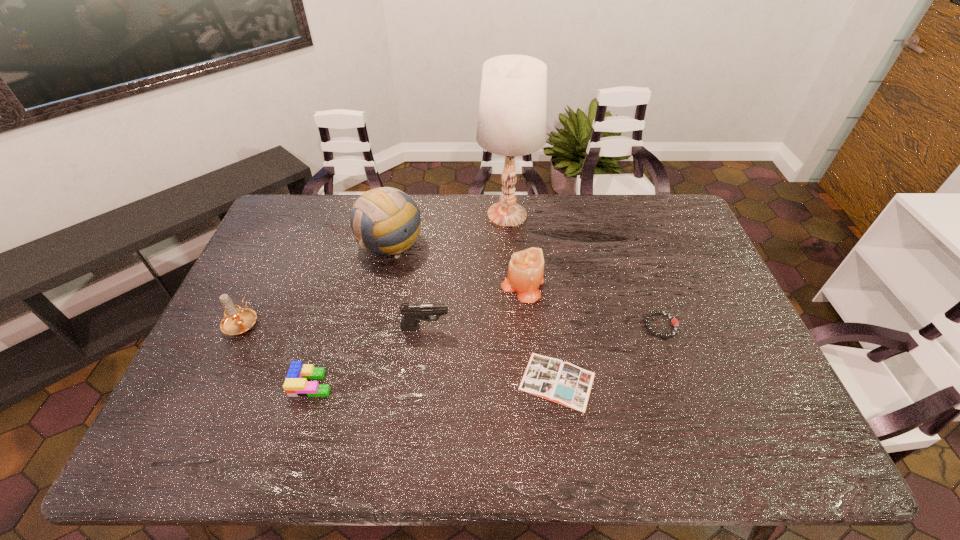
You are a GUI agent. You are given a task and a screenshot of the screen. Output one action in this format:
    pyautogui.click(x=<x>, y=<y>)
    Task: Click on the free space that satisfies the following two spatial constraints: 1. at the barrel of the fifth tallest object; 2. on the right side of the book
    The image size is (960, 540).
    Given the screenshot: What is the action you would take?
    pyautogui.click(x=420, y=381)

Where is `vacant space that satisfies the following two spatial constraints: 1. on the back side of the lamp; 2. on the right side of the nearer candle`? vacant space that satisfies the following two spatial constraints: 1. on the back side of the lamp; 2. on the right side of the nearer candle is located at coordinates (293, 214).

Locate an element on the screen. The width and height of the screenshot is (960, 540). vacant space that satisfies the following two spatial constraints: 1. on the front side of the rightmost object; 2. at the barrel of the pistol is located at coordinates (661, 327).